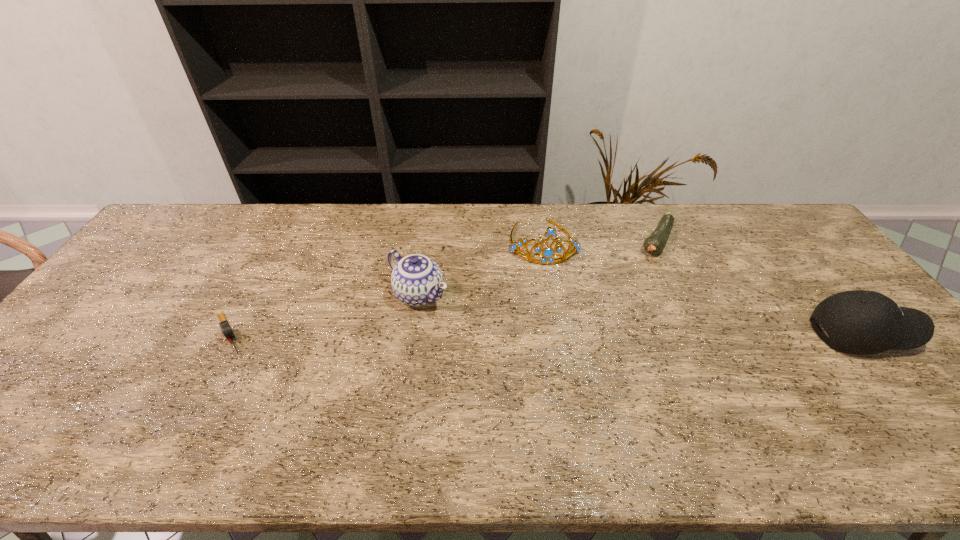
Locate an element on the screen. free spot on the desktop that is between the shortest object and the rightmost object and is positioned at the spout of the second object from left to right is located at coordinates (473, 334).

At what (x,y) coordinates should I click in order to perform the action: click on vacant space on the desktop that is between the leftmost object and the rightmost object and is positioned at the blossom end of the fourth tallest object. Please return your answer as a coordinate pair (x, y). The image size is (960, 540). Looking at the image, I should click on (592, 334).

Image resolution: width=960 pixels, height=540 pixels. I want to click on vacant space on the desktop that is between the tape measure and the baseball cap and is positioned on the front-facing side of the third object from left to right, so click(558, 334).